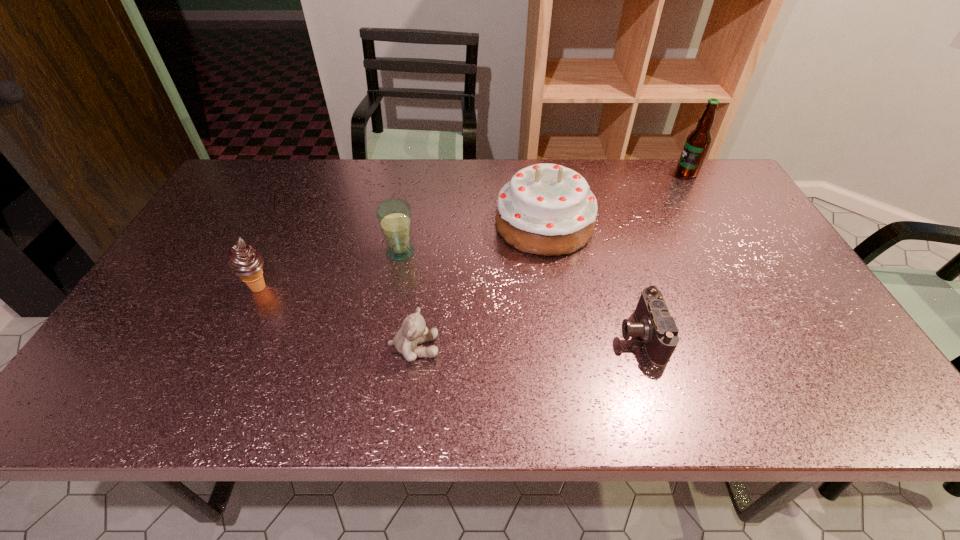
Find the location of a particular element. This screenshot has width=960, height=540. free area in between the leftmost object and the shortest object is located at coordinates (450, 311).

Identify the location of vacant region between the teddy bear and the glass. The image size is (960, 540). (407, 300).

Where is `empty space that is in between the fifth shortest object and the second shortest object`? This screenshot has height=540, width=960. empty space that is in between the fifth shortest object and the second shortest object is located at coordinates (479, 286).

Locate an element on the screen. The width and height of the screenshot is (960, 540). empty location between the beer bottle and the fourth farthest object is located at coordinates (473, 230).

Identify the location of free spot between the fifth shortest object and the teddy bear. This screenshot has height=540, width=960. (479, 286).

The height and width of the screenshot is (540, 960). I want to click on vacant area that lies between the second shortest object and the second tallest object, so click(479, 286).

Locate which object ranks second in proximity to the teddy bear. Please provide its 2D coordinates. Your answer should be formatted as a tuple, i.e. [(x, y)], where the tuple contains the x and y coordinates of a point satisfying the conditions above.

[(546, 209)]

Locate which object is the fourth closest to the glass. Please provide its 2D coordinates. Your answer should be formatted as a tuple, i.e. [(x, y)], where the tuple contains the x and y coordinates of a point satisfying the conditions above.

[(655, 326)]

The width and height of the screenshot is (960, 540). Find the location of `free location that satisfies the following two spatial constraints: 1. on the back side of the fifth shortest object; 2. on the right side of the icecream`. free location that satisfies the following two spatial constraints: 1. on the back side of the fifth shortest object; 2. on the right side of the icecream is located at coordinates (289, 225).